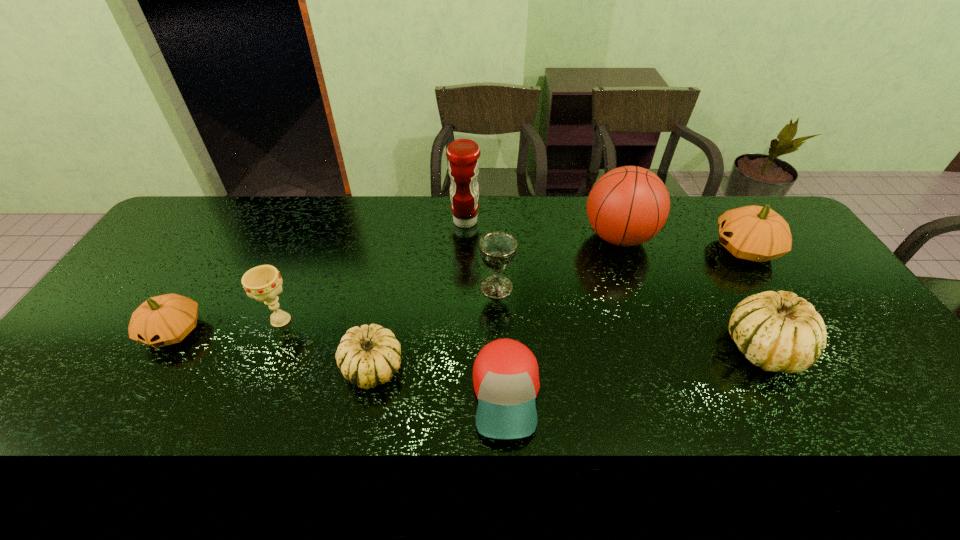
Where is `red condiment`? The height and width of the screenshot is (540, 960). red condiment is located at coordinates (463, 165).

Identify the location of the third object from right to left. (627, 206).

Where is `the farthest gourd`? This screenshot has width=960, height=540. the farthest gourd is located at coordinates (754, 233).

Locate an element on the screen. Image resolution: width=960 pixels, height=540 pixels. the right orange gourd is located at coordinates (754, 233).

Identify the location of the farther chalice. This screenshot has height=540, width=960. (497, 249).

You are a GUI agent. You are given a task and a screenshot of the screen. Output one action in this format:
    pyautogui.click(x=<x>, y=<y>)
    Task: Click on the fourth farthest object
    
    Given the screenshot: What is the action you would take?
    pyautogui.click(x=497, y=249)

The width and height of the screenshot is (960, 540). I want to click on the eighth object from right to left, so click(x=263, y=283).

This screenshot has width=960, height=540. In order to click on the nearer chalice in this screenshot , I will do `click(263, 283)`.

The height and width of the screenshot is (540, 960). I want to click on the right white gourd, so [778, 331].

Image resolution: width=960 pixels, height=540 pixels. I want to click on the leftmost gourd, so click(x=167, y=319).